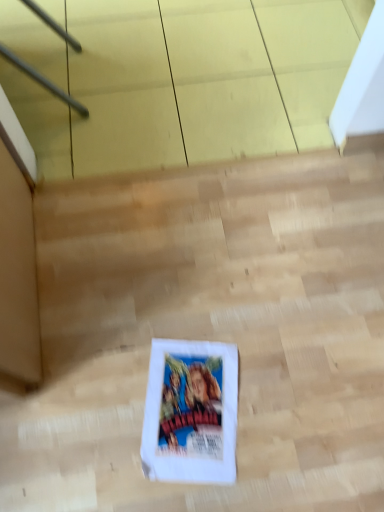
You are a GUI agent. You are given a task and a screenshot of the screen. Output one action in this format:
    pyautogui.click(x=<x>, y=<y>)
    Task: Click on the vacant area situated to the left side of white paper comic book at center
    
    Given the screenshot: What is the action you would take?
    click(x=102, y=404)